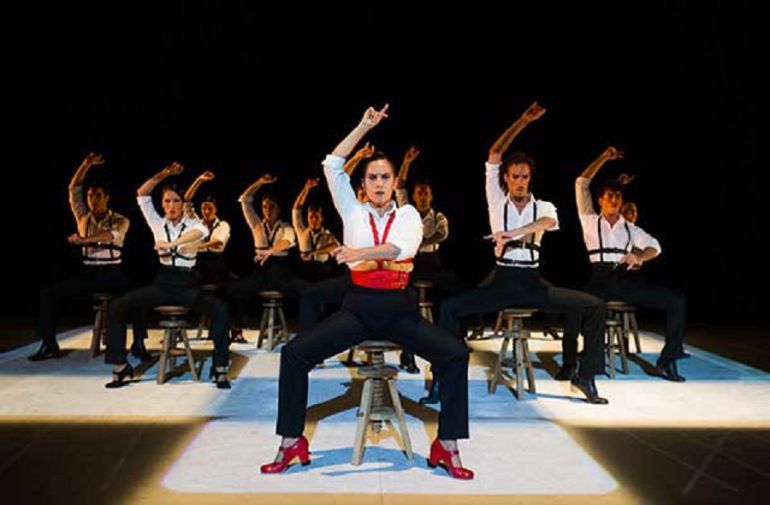
Locate an element on the screen. The height and width of the screenshot is (505, 770). stools is located at coordinates (96, 312), (172, 356), (206, 330), (275, 325), (420, 311), (427, 287), (386, 417), (537, 367), (614, 331), (633, 323).